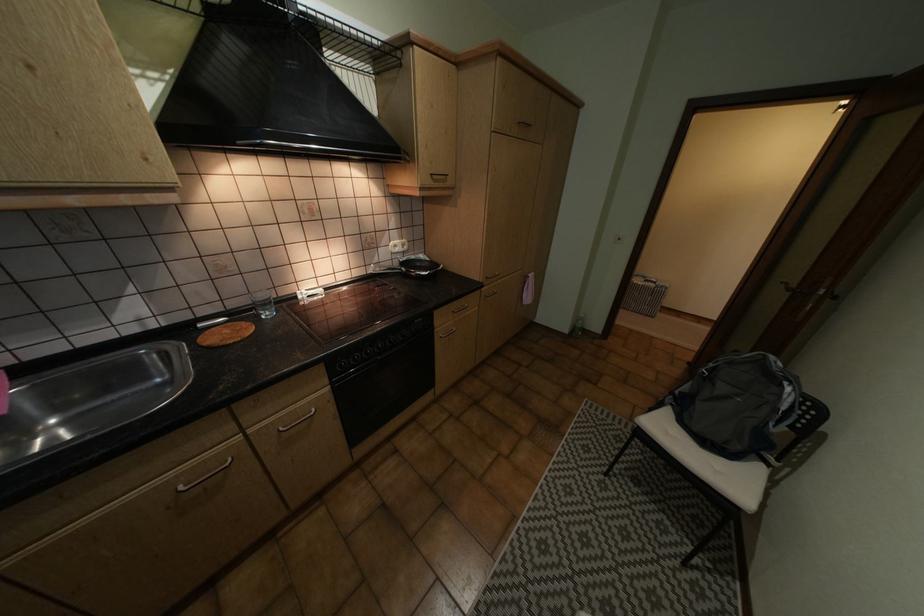
Find the location of a particular element. green glass bottle is located at coordinates (578, 326).